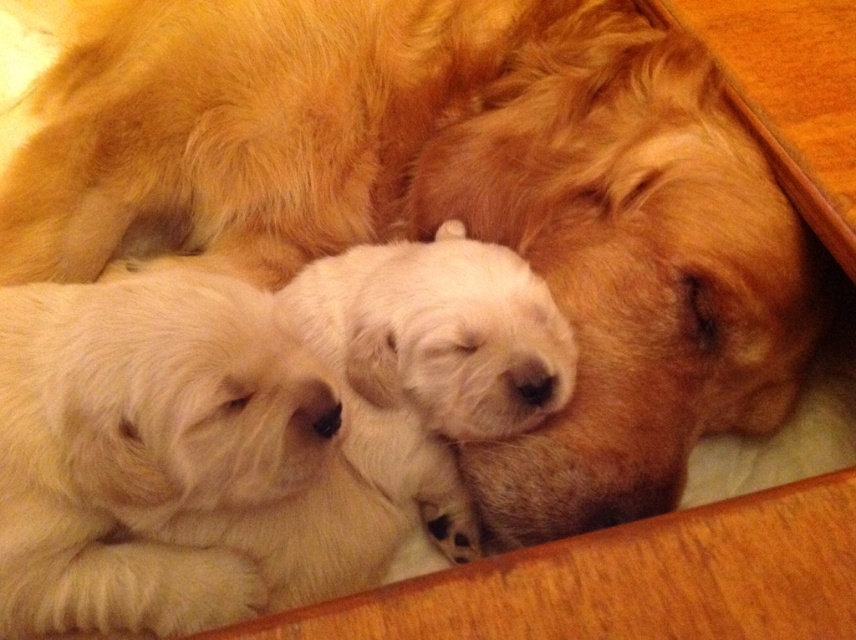
Between white fluffy puppy at left and white fluffy puppies at center, which one appears on the right side from the viewer's perspective?

Positioned to the right is white fluffy puppies at center.

Is white fluffy puppy at left positioned at the back of white fluffy puppies at center?

No.

Is point (141, 387) positioned in front of point (507, 252)?

Yes, point (141, 387) is closer to viewer.

The image size is (856, 640). I want to click on white fluffy puppy at left, so click(x=146, y=448).